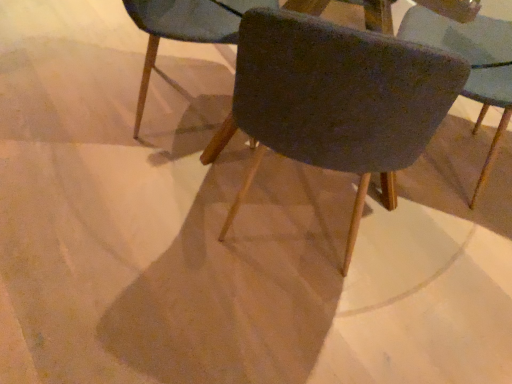
Question: Looking at the image, does velvet dark blue chair at center, which is the 1th chair from right to left, seem bigger or smaller compared to velvet dark blue chair at center, the 1th chair in the left-to-right sequence?

Choices:
 (A) small
 (B) big

Answer: (B)

Question: From their relative heights in the image, would you say velvet dark blue chair at center, the 3th chair viewed from the left, is taller or shorter than velvet dark blue chair at center, the 1th chair in the left-to-right sequence?

Choices:
 (A) tall
 (B) short

Answer: (A)

Question: Considering the real-world distances, which object is closest to the velvet dark blue chair at center, the 3th chair viewed from the left?

Choices:
 (A) velvet dark blue chair at center, the second chair when ordered from right to left
 (B) velvet dark blue chair at center, the 3th chair from the right

Answer: (B)

Question: Which is nearer to the velvet dark blue chair at center, the 3th chair viewed from the left?

Choices:
 (A) velvet dark blue chair at center, the 1th chair in the left-to-right sequence
 (B) velvet dark blue chair at center, the second chair when ordered from right to left

Answer: (A)